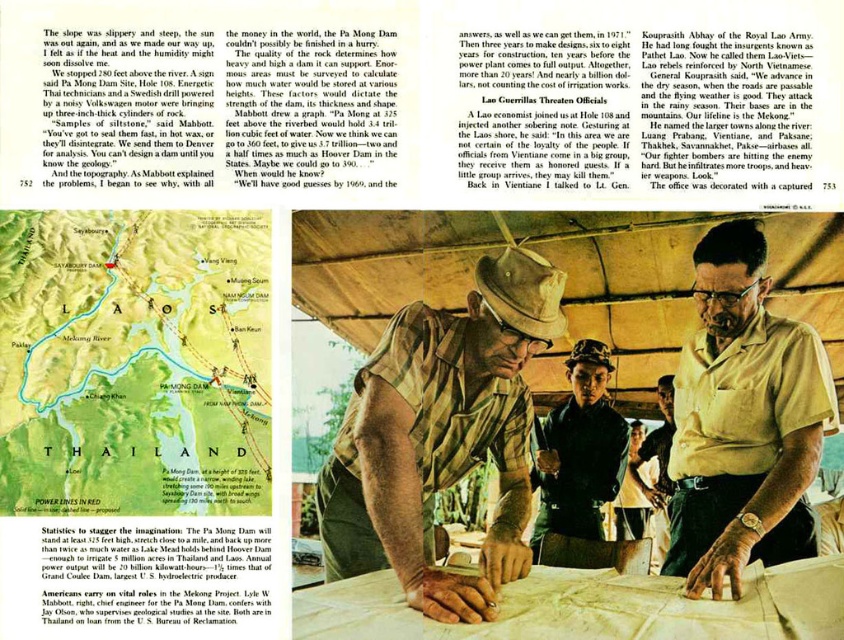
You are a tour guide standing in front of the green paper map at bottom left and the dark green uniform at center. Which object is taller?

The dark green uniform at center is taller than the green paper map at bottom left.

Looking at this image, you are observing the photograph of individuals in the right section of the image. Both the khaki fabric shirt at center and the tan shirt at center are visible. Which of these shirts has a shorter length?

The khaki fabric shirt at center is shorter than the tan shirt at center.